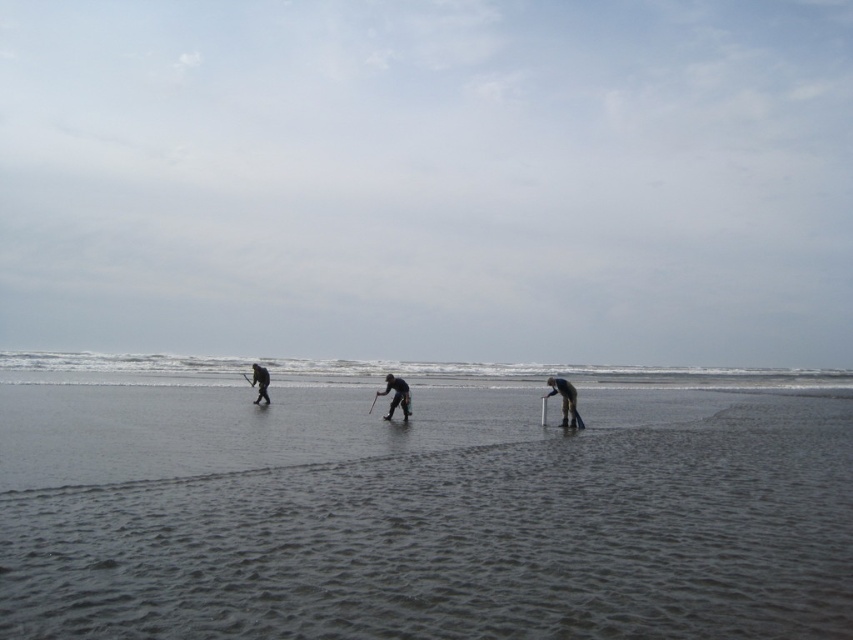
Question: Does clear water at center come in front of dark gray fabric pants at left?

Choices:
 (A) yes
 (B) no

Answer: (B)

Question: Which of these objects is positioned closest to the dark gray fabric pants at left?

Choices:
 (A) smooth sand beach at center
 (B) dark gray fabric pants at center
 (C) clear water at center

Answer: (B)

Question: Where is clear water at center located in relation to dark gray fabric pants at left in the image?

Choices:
 (A) left
 (B) right

Answer: (B)

Question: Does dark gray fabric pants at lower center lie in front of dark gray fabric pants at center?

Choices:
 (A) no
 (B) yes

Answer: (B)

Question: Which of the following is the closest to the observer?

Choices:
 (A) clear water at center
 (B) dark gray fabric pants at lower center
 (C) smooth sand beach at center
 (D) dark gray fabric pants at left

Answer: (C)

Question: Among these points, which one is nearest to the camera?

Choices:
 (A) (466, 400)
 (B) (289, 376)

Answer: (A)